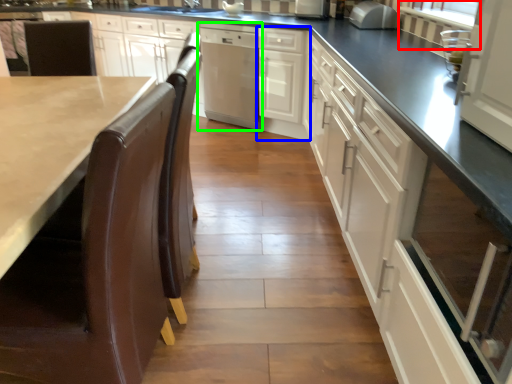
Question: Which object is positioned closest to window screen (highlighted by a red box)? Select from cabinetry (highlighted by a blue box) and home appliance (highlighted by a green box).

Choices:
 (A) cabinetry
 (B) home appliance

Answer: (A)